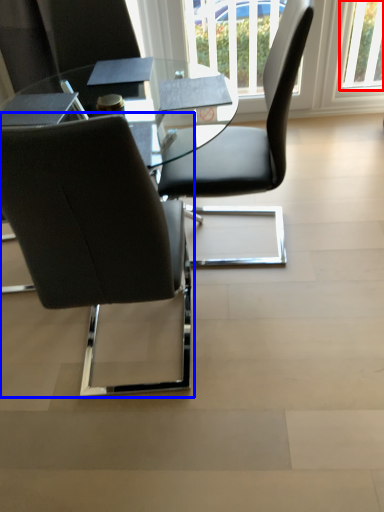
Question: Which object is closer to the camera taking this photo, window (highlighted by a red box) or chair (highlighted by a blue box)?

Choices:
 (A) window
 (B) chair

Answer: (B)